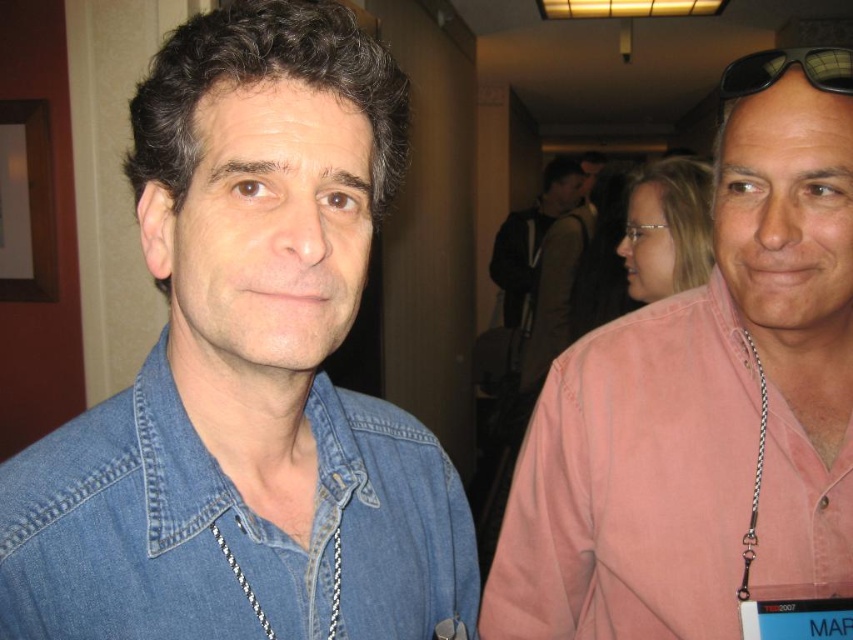
Based on the photo, you are standing in the hallway and need to locate the person wearing the denim shirt at left. According to the coordinates provided, where should you look to find them?

The person wearing the denim shirt at left is located at coordinates point (231,529).

You are a photographer adjusting your camera settings in a crowded hallway. You notice the denim jacket at center and the white braided cord at right. Which object is closer to the camera lens?

The denim jacket at center is closer to the camera lens because it is in front of the white braided cord at right.

You are at a networking event and need to approach the person wearing the denim shirt at left and the white braided cord at right. Which one should you walk towards if you want to greet the person on the left side of the group?

You should walk towards the denim shirt at left since it is positioned on the left side of the white braided cord at right, indicating it is further to the left in the group.